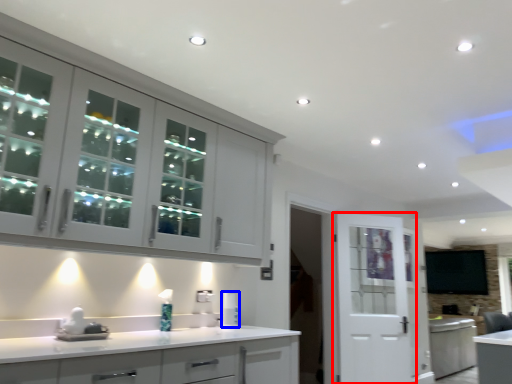
Question: Which object is closer to the camera taking this photo, door (highlighted by a red box) or appliance (highlighted by a blue box)?

Choices:
 (A) door
 (B) appliance

Answer: (B)